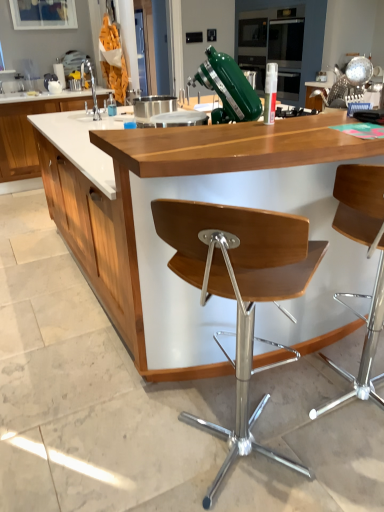
What do you see at coordinates (201, 200) in the screenshot? Image resolution: width=384 pixels, height=512 pixels. I see `wooden counter at center, placed as the 2th countertop when sorted from back to front` at bounding box center [201, 200].

This screenshot has height=512, width=384. What do you see at coordinates (43, 96) in the screenshot? I see `white marble countertop at upper left, the 2th countertop from the right` at bounding box center [43, 96].

What is the approximate width of wooden chair at center, which is the second chair from right to left?

wooden chair at center, which is the second chair from right to left, is 58.91 centimeters in width.

Image resolution: width=384 pixels, height=512 pixels. I want to click on brushed metal sink at left, so click(x=92, y=93).

From the image's perspective, would you say wooden counter at center, placed as the 2th countertop when sorted from back to front, is positioned over wooden chair at center, which is the second chair from right to left?

Yes, from the image's perspective, wooden counter at center, placed as the 2th countertop when sorted from back to front, is over wooden chair at center, which is the second chair from right to left.

Could you measure the distance between wooden counter at center, the second countertop when ordered from top to bottom, and wooden chair at center, the 1th chair in the left-to-right sequence?

The distance of wooden counter at center, the second countertop when ordered from top to bottom, from wooden chair at center, the 1th chair in the left-to-right sequence, is 23.03 inches.

Is wooden counter at center, which is the 1th countertop in right-to-left order, further to the viewer compared to wooden chair at center, which is the second chair from right to left?

That is True.

What's the angular difference between wooden counter at center, the second countertop when ordered from top to bottom, and wooden chair at center, which is the second chair from right to left,'s facing directions?

There is a 53.1-degree angle between the facing directions of wooden counter at center, the second countertop when ordered from top to bottom, and wooden chair at center, which is the second chair from right to left.

Does white wood cabinet at left touch white marble countertop at upper left, the first countertop positioned from the back?

white wood cabinet at left and white marble countertop at upper left, the first countertop positioned from the back, are clearly separated.

From a real-world perspective, which object stands above the other?

white marble countertop at upper left, positioned as the 1th countertop in left-to-right order, is physically above.

Which of these two, white wood cabinet at left or white marble countertop at upper left, which appears as the second countertop when ordered from the bottom, is bigger?

white wood cabinet at left.

Is white wood cabinet at left aimed at white marble countertop at upper left, which appears as the second countertop when ordered from the bottom?

No, white wood cabinet at left does not turn towards white marble countertop at upper left, which appears as the second countertop when ordered from the bottom.

From the picture: Is wooden seat at center, acting as the 2th chair starting from the left, placed right next to brushed metal sink at left?

wooden seat at center, acting as the 2th chair starting from the left, is not next to brushed metal sink at left, and they're not touching.

Considering the positions of objects wooden seat at center, the 1th chair viewed from the right, and brushed metal sink at left in the image provided, who is behind, wooden seat at center, the 1th chair viewed from the right, or brushed metal sink at left?

Positioned behind is brushed metal sink at left.

Where is `sink above the wooden seat at center, the 1th chair viewed from the right (from a real-world perspective)`? sink above the wooden seat at center, the 1th chair viewed from the right (from a real-world perspective) is located at coordinates (92, 93).

In terms of height, does wooden seat at center, acting as the 2th chair starting from the left, look taller or shorter compared to brushed metal sink at left?

Result: Considering their sizes, wooden seat at center, acting as the 2th chair starting from the left, has more height than brushed metal sink at left.

Does white marble countertop at upper left, the 2th countertop from the right, have a greater height compared to wooden counter at center, placed as the 2th countertop when sorted from back to front?

In fact, white marble countertop at upper left, the 2th countertop from the right, may be shorter than wooden counter at center, placed as the 2th countertop when sorted from back to front.

Which of these two, white marble countertop at upper left, marked as the 2th countertop in a front-to-back arrangement, or wooden counter at center, which is the 2th countertop from left to right, is thinner?

white marble countertop at upper left, marked as the 2th countertop in a front-to-back arrangement, is thinner.

Between white marble countertop at upper left, the 2th countertop from the right, and wooden counter at center, placed as the 2th countertop when sorted from back to front, which one appears on the right side from the viewer's perspective?

From the viewer's perspective, wooden counter at center, placed as the 2th countertop when sorted from back to front, appears more on the right side.

This screenshot has width=384, height=512. In order to click on countertop lying below the white marble countertop at upper left, which ranks as the first countertop in top-to-bottom order (from the image's perspective) in this screenshot , I will do `click(201, 200)`.

What's the angular difference between wooden chair at center, the 1th chair in the left-to-right sequence, and brushed metal sink at left's facing directions?

The angular difference between wooden chair at center, the 1th chair in the left-to-right sequence, and brushed metal sink at left is 57.2 degrees.

Would you say wooden chair at center, the 1th chair in the left-to-right sequence, is inside or outside brushed metal sink at left?

wooden chair at center, the 1th chair in the left-to-right sequence, is not inside brushed metal sink at left, it's outside.

Looking at the image, does wooden chair at center, the 1th chair in the left-to-right sequence, seem bigger or smaller compared to brushed metal sink at left?

In the image, wooden chair at center, the 1th chair in the left-to-right sequence, appears to be larger than brushed metal sink at left.

From the image's perspective, is wooden chair at center, which is the second chair from right to left, above or below brushed metal sink at left?

Clearly, from the image's perspective, wooden chair at center, which is the second chair from right to left, is below brushed metal sink at left.

Relative to white wood cabinet at left, is wooden chair at center, which is the second chair from right to left, in front or behind?

In the image, wooden chair at center, which is the second chair from right to left, appears in front of white wood cabinet at left.

How many degrees apart are the facing directions of wooden chair at center, the 1th chair in the left-to-right sequence, and white wood cabinet at left?

The facing directions of wooden chair at center, the 1th chair in the left-to-right sequence, and white wood cabinet at left are 127 degrees apart.

Does wooden chair at center, which is the second chair from right to left, have a smaller size compared to white wood cabinet at left?

Indeed, wooden chair at center, which is the second chair from right to left, has a smaller size compared to white wood cabinet at left.

From a real-world perspective, which is physically below, wooden chair at center, which is the second chair from right to left, or white wood cabinet at left?

white wood cabinet at left is physically lower.

Does white marble countertop at upper left, which appears as the second countertop when ordered from the bottom, lie in front of brushed metal sink at left?

No, white marble countertop at upper left, which appears as the second countertop when ordered from the bottom, is further to the viewer.

Is point (21, 100) less distant than point (112, 103)?

No, (21, 100) is further to viewer.

Where is `sink to the right of white marble countertop at upper left, which ranks as the first countertop in top-to-bottom order`? The image size is (384, 512). sink to the right of white marble countertop at upper left, which ranks as the first countertop in top-to-bottom order is located at coordinates tap(92, 93).

Is white marble countertop at upper left, which appears as the second countertop when ordered from the bottom, oriented away from brushed metal sink at left?

No, white marble countertop at upper left, which appears as the second countertop when ordered from the bottom,'s orientation is not away from brushed metal sink at left.

Find the location of a particular element. the 1st countertop behind the wooden chair at center, which is the second chair from right to left is located at coordinates (201, 200).

Where is `countertop above the white wood cabinet at left (from the image's perspective)`? countertop above the white wood cabinet at left (from the image's perspective) is located at coordinates (43, 96).

Which object lies nearer to the anchor point white wood cabinet at left, brushed metal sink at left or wooden counter at center, placed as the 2th countertop when sorted from back to front?

brushed metal sink at left lies closer to white wood cabinet at left than the other object.

Considering their positions, is white wood cabinet at left positioned further to wooden chair at center, the 1th chair in the left-to-right sequence, than wooden seat at center, acting as the 2th chair starting from the left?

white wood cabinet at left is positioned further to the anchor wooden chair at center, the 1th chair in the left-to-right sequence.

Based on their spatial positions, is brushed metal sink at left or wooden counter at center, acting as the first countertop starting from the bottom, further from wooden chair at center, the 1th chair in the left-to-right sequence?

The object further to wooden chair at center, the 1th chair in the left-to-right sequence, is brushed metal sink at left.

Considering their positions, is white wood cabinet at left positioned further to white marble countertop at upper left, which appears as the second countertop when ordered from the bottom, than wooden chair at center, which is the second chair from right to left?

wooden chair at center, which is the second chair from right to left.

Which object lies nearer to the anchor point wooden chair at center, the 1th chair in the left-to-right sequence, wooden seat at center, the 1th chair viewed from the right, or wooden counter at center, placed as the 2th countertop when sorted from back to front?

wooden counter at center, placed as the 2th countertop when sorted from back to front, is positioned closer to the anchor wooden chair at center, the 1th chair in the left-to-right sequence.

Based on their spatial positions, is wooden chair at center, the 1th chair in the left-to-right sequence, or wooden counter at center, which is the 2th countertop from left to right, closer to white wood cabinet at left?

Based on the image, wooden counter at center, which is the 2th countertop from left to right, appears to be nearer to white wood cabinet at left.

When comparing their distances from wooden seat at center, acting as the 2th chair starting from the left, does white marble countertop at upper left, which appears as the second countertop when ordered from the bottom, or white wood cabinet at left seem further?

white marble countertop at upper left, which appears as the second countertop when ordered from the bottom, is further to wooden seat at center, acting as the 2th chair starting from the left.

When comparing their distances from brushed metal sink at left, does wooden chair at center, which is the second chair from right to left, or wooden counter at center, which is the 2th countertop from left to right, seem closer?

wooden counter at center, which is the 2th countertop from left to right, is positioned closer to the anchor brushed metal sink at left.

The height and width of the screenshot is (512, 384). Find the location of `chair between wooden counter at center, acting as the first countertop starting from the bottom, and white marble countertop at upper left, the 2th countertop from the right, in the front-back direction`. chair between wooden counter at center, acting as the first countertop starting from the bottom, and white marble countertop at upper left, the 2th countertop from the right, in the front-back direction is located at coordinates (368, 258).

Find the location of `sink between wooden seat at center, the 1th chair viewed from the right, and white wood cabinet at left, along the z-axis`. sink between wooden seat at center, the 1th chair viewed from the right, and white wood cabinet at left, along the z-axis is located at coordinates (92, 93).

The width and height of the screenshot is (384, 512). I want to click on countertop positioned between wooden chair at center, the 1th chair in the left-to-right sequence, and brushed metal sink at left from near to far, so click(201, 200).

Identify the location of cabinetry between wooden chair at center, the 1th chair in the left-to-right sequence, and white marble countertop at upper left, which ranks as the first countertop in top-to-bottom order, in the front-back direction. This screenshot has width=384, height=512. (28, 132).